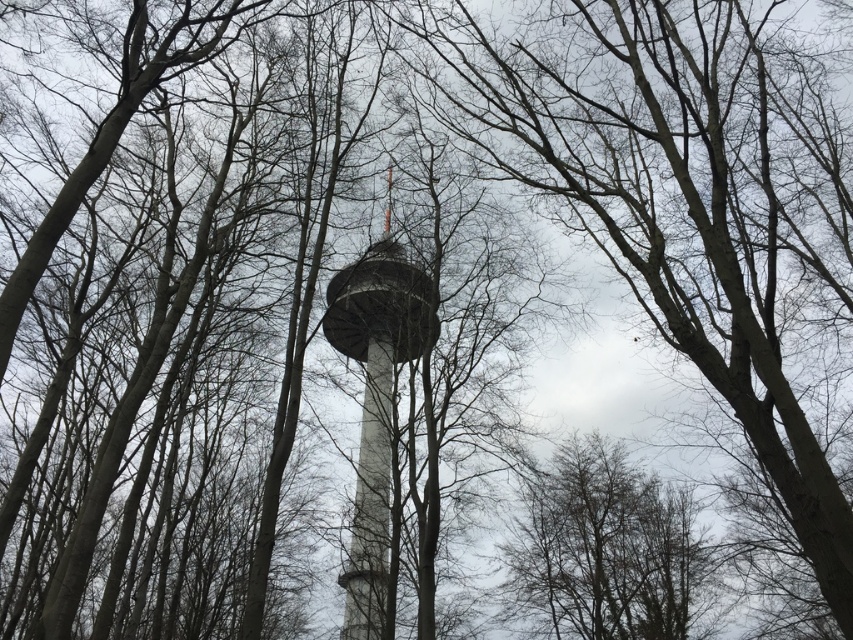
Looking at this image, who is taller, brown textured tree at center or smooth white tower at center?

smooth white tower at center is taller.

Is brown textured tree at center below smooth white tower at center?

Indeed, brown textured tree at center is positioned under smooth white tower at center.

Who is more distant from viewer, [680,493] or [387,492]?

The point [680,493] is more distant.

Locate an element on the screen. The image size is (853, 640). brown textured tree at center is located at coordinates (604, 550).